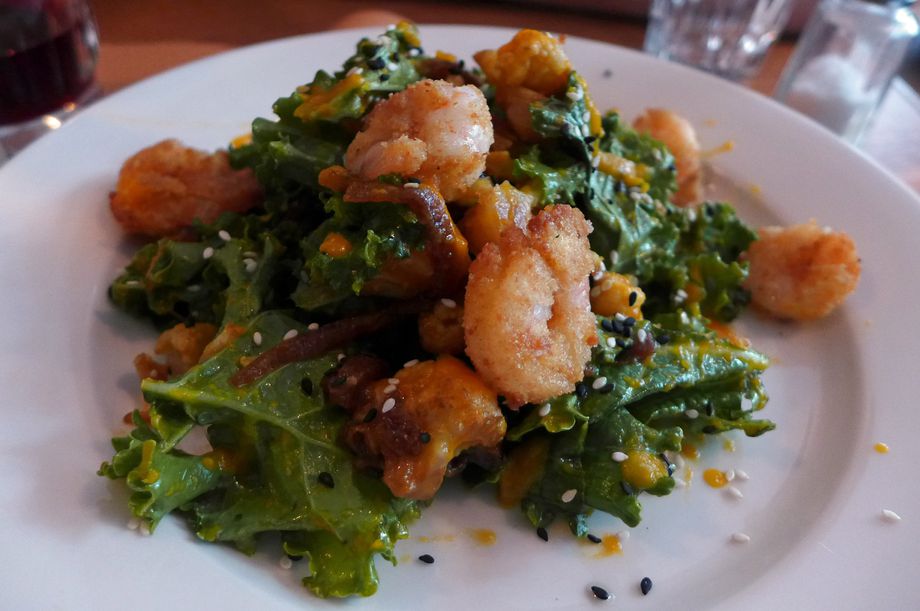
Where is `space between empty glass and salt shaker`? This screenshot has height=611, width=920. space between empty glass and salt shaker is located at coordinates (351, 310), (768, 68).